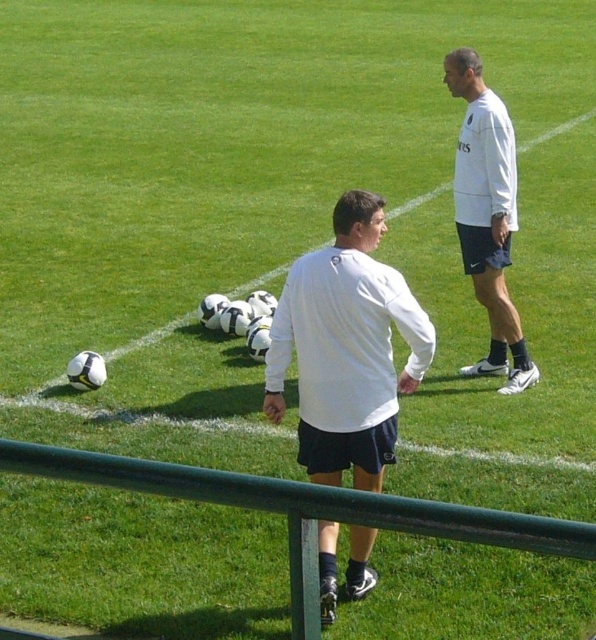
Question: From the image, what is the correct spatial relationship of white matte shirt at center in relation to green metal rail at lower center?

Choices:
 (A) below
 (B) above

Answer: (B)

Question: Which point appears farthest from the camera in this image?

Choices:
 (A) (411, 362)
 (B) (489, 323)
 (C) (315, 572)

Answer: (B)

Question: Which object is positioned farthest from the white matte shirt at upper right?

Choices:
 (A) green metal rail at lower center
 (B) white matte shirt at center

Answer: (A)

Question: Which of these objects is positioned farthest from the green metal rail at lower center?

Choices:
 (A) white matte shirt at upper right
 (B) white matte shirt at center

Answer: (A)

Question: Can you confirm if green metal rail at lower center is thinner than white matte shirt at upper right?

Choices:
 (A) yes
 (B) no

Answer: (B)

Question: Does green metal rail at lower center appear over white matte shirt at upper right?

Choices:
 (A) no
 (B) yes

Answer: (A)